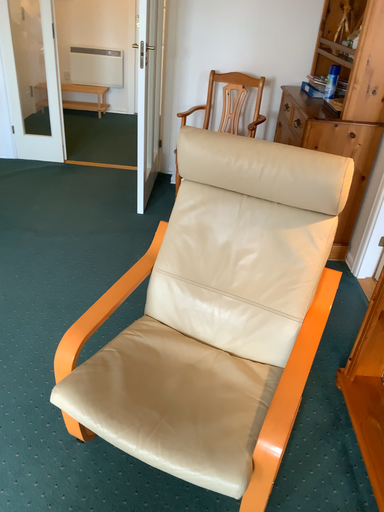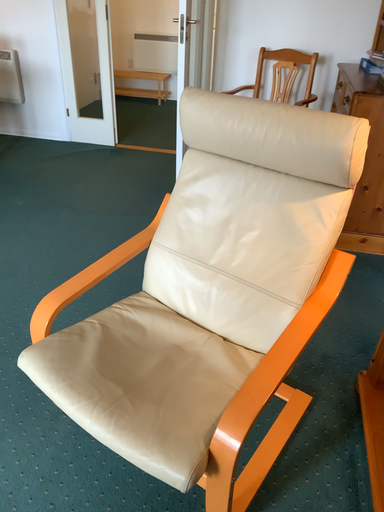
Question: Which way did the camera rotate in the video?

Choices:
 (A) rotated right
 (B) rotated left

Answer: (B)